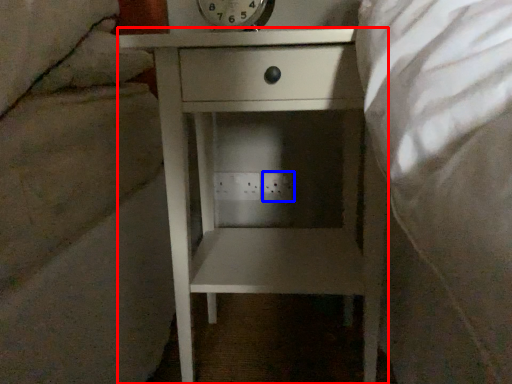
Question: Which object appears farthest to the camera in this image, nightstand (highlighted by a red box) or electric outlet (highlighted by a blue box)?

Choices:
 (A) nightstand
 (B) electric outlet

Answer: (B)